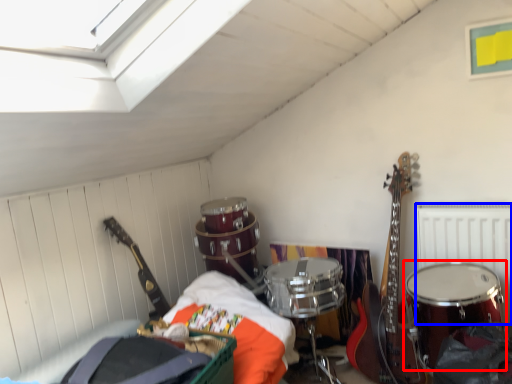
Question: Which object appears closest to the camera in this image, drum (highlighted by a red box) or radiator (highlighted by a blue box)?

Choices:
 (A) drum
 (B) radiator

Answer: (A)